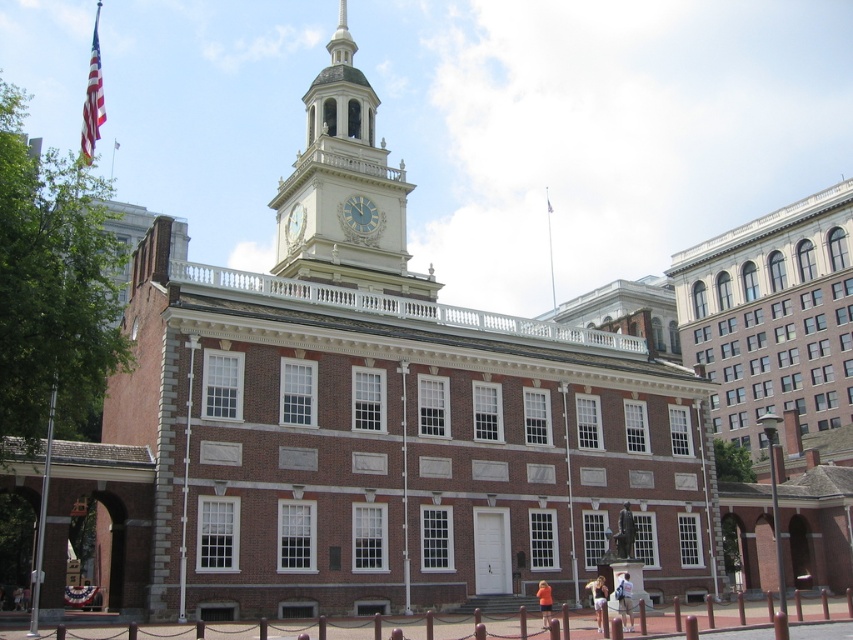
You are a tourist standing in front of Independence Hall. You notice the metallic clock face at center and the american flag at upper center. Which object is positioned to the left of the other?

The metallic clock face at center is to the left of the american flag at upper center.

You are a tour guide leading a group near Independence Hall. You notice a light brown leather backpack at lower center and denim shorts at lower center. Which object is narrower?

The light brown leather backpack at lower center is narrower than the denim shorts at lower center.